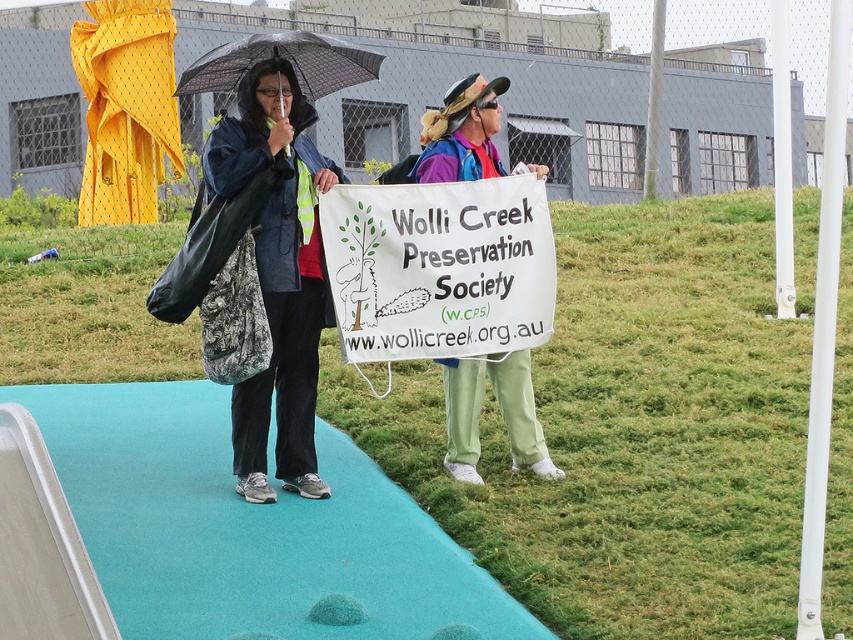
Who is lower down, light green fabric pants at center or transparent plastic umbrella at upper center?

light green fabric pants at center is lower down.

In order to click on light green fabric pants at center in this screenshot , I will do `click(500, 412)`.

Is point (531, 436) positioned before point (265, 42)?

No, (531, 436) is behind (265, 42).

This screenshot has height=640, width=853. What are the coordinates of `light green fabric pants at center` in the screenshot? It's located at (500, 412).

Is green grass at center thinner than matte blue jacket at center?

No.

This screenshot has width=853, height=640. Identify the location of green grass at center. (633, 428).

Which is more to the left, teal carpet at center or matte blue jacket at center?

From the viewer's perspective, teal carpet at center appears more on the left side.

Which of these two, teal carpet at center or matte blue jacket at center, stands taller?

Standing taller between the two is matte blue jacket at center.

This screenshot has height=640, width=853. I want to click on teal carpet at center, so click(x=247, y=525).